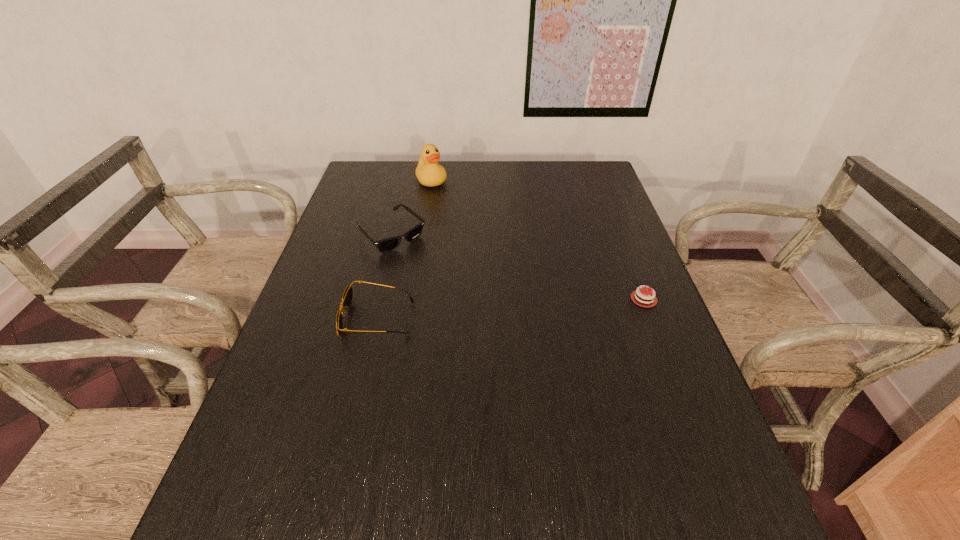
Find the location of `vacant space at the right edge of the desktop`. vacant space at the right edge of the desktop is located at coordinates (619, 224).

Identify the location of blank space at the far left corner of the desktop. The image size is (960, 540). (373, 161).

Locate an element on the screen. blank space at the near left corner is located at coordinates (316, 446).

The width and height of the screenshot is (960, 540). Identify the location of vacant space at the far right corner of the desktop. (592, 193).

Where is `vacant point located between the farther sunglasses and the nearer sunglasses`? This screenshot has height=540, width=960. vacant point located between the farther sunglasses and the nearer sunglasses is located at coordinates (385, 277).

You are a GUI agent. You are given a task and a screenshot of the screen. Output one action in this format:
    pyautogui.click(x=<x>, y=<y>)
    Task: Click on the free point between the nearer sunglasses and the chocolate cake
    
    Given the screenshot: What is the action you would take?
    pyautogui.click(x=511, y=309)

Identify the location of empty space that is in between the shortest object and the duck. The image size is (960, 540). (538, 240).

Find the location of a particular element. vacant area that lies between the farther sunglasses and the duck is located at coordinates (412, 208).

Locate an element on the screen. free space between the duck and the nearer sunglasses is located at coordinates (405, 249).

Identify the location of free space that is in between the chocolate cake and the third nearest object. (517, 267).